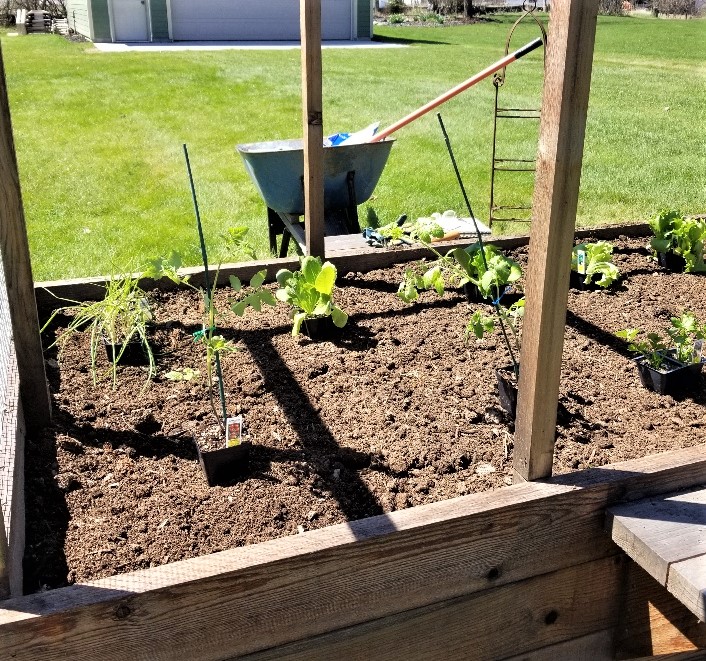
Identify the location of door. (136, 28).